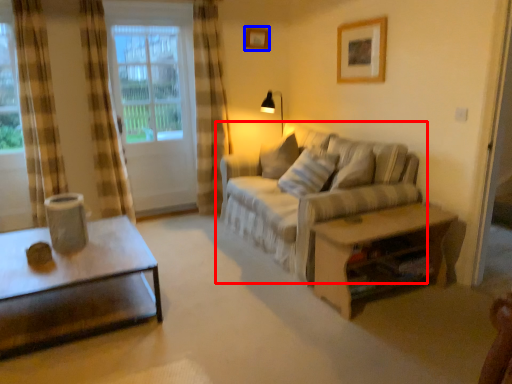
Question: Which object appears closest to the camera in this image, studio couch (highlighted by a red box) or picture frame (highlighted by a blue box)?

Choices:
 (A) studio couch
 (B) picture frame

Answer: (A)